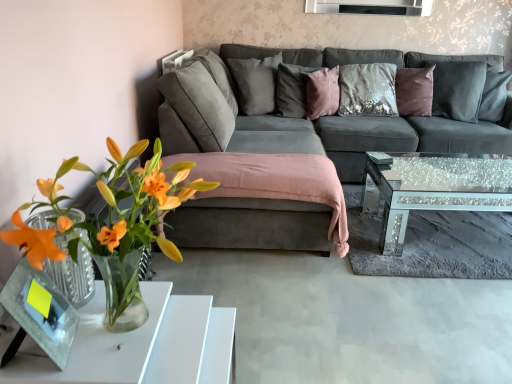
Question: Is velvet purple pillow at upper right, which is the 4th pillow in left-to-right order, in contact with satin gray pillow at upper center, which is the 1th pillow from left to right?

Choices:
 (A) no
 (B) yes

Answer: (A)

Question: Can you confirm if velvet purple pillow at upper right, which is the 4th pillow in left-to-right order, is wider than satin gray pillow at upper center, acting as the 4th pillow starting from the right?

Choices:
 (A) yes
 (B) no

Answer: (A)

Question: From the image's perspective, would you say velvet purple pillow at upper right, acting as the 1th pillow starting from the right, is shown under satin gray pillow at upper center, which is the 1th pillow from left to right?

Choices:
 (A) no
 (B) yes

Answer: (B)

Question: From a real-world perspective, is velvet purple pillow at upper right, acting as the 1th pillow starting from the right, physically above satin gray pillow at upper center, acting as the 4th pillow starting from the right?

Choices:
 (A) no
 (B) yes

Answer: (A)

Question: Can we say velvet purple pillow at upper right, acting as the 1th pillow starting from the right, lies outside satin gray pillow at upper center, which is the 1th pillow from left to right?

Choices:
 (A) no
 (B) yes

Answer: (B)

Question: Does velvet purple pillow at upper right, acting as the 1th pillow starting from the right, have a smaller size compared to satin gray pillow at upper center, acting as the 4th pillow starting from the right?

Choices:
 (A) yes
 (B) no

Answer: (B)

Question: Considering the relative sizes of translucent glass vase at lower left and satin purple pillow at center, arranged as the third pillow when viewed from the left, in the image provided, is translucent glass vase at lower left thinner than satin purple pillow at center, arranged as the third pillow when viewed from the left,?

Choices:
 (A) no
 (B) yes

Answer: (A)

Question: From a real-world perspective, is translucent glass vase at lower left below satin purple pillow at center, arranged as the third pillow when viewed from the left?

Choices:
 (A) yes
 (B) no

Answer: (B)

Question: Can we say translucent glass vase at lower left lies outside satin purple pillow at center, acting as the second pillow starting from the right?

Choices:
 (A) no
 (B) yes

Answer: (B)

Question: From the image's perspective, is translucent glass vase at lower left above satin purple pillow at center, arranged as the third pillow when viewed from the left?

Choices:
 (A) yes
 (B) no

Answer: (B)

Question: Could you tell me if translucent glass vase at lower left is facing satin purple pillow at center, acting as the second pillow starting from the right?

Choices:
 (A) no
 (B) yes

Answer: (A)

Question: From a real-world perspective, is translucent glass vase at lower left located higher than satin purple pillow at center, acting as the second pillow starting from the right?

Choices:
 (A) yes
 (B) no

Answer: (A)

Question: Considering the relative sizes of translucent glass vase at lower left and sparkly glass coffee table at center in the image provided, is translucent glass vase at lower left wider than sparkly glass coffee table at center?

Choices:
 (A) yes
 (B) no

Answer: (B)